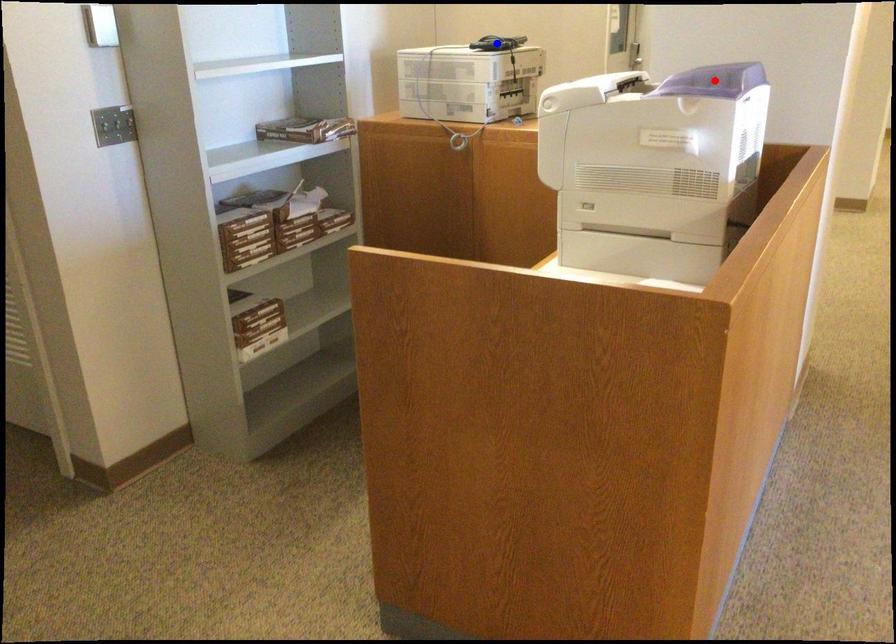
Question: In the image, two points are highlighted. Which point is nearer to the camera? Reply with the corresponding letter.

Choices:
 (A) blue point
 (B) red point

Answer: (B)